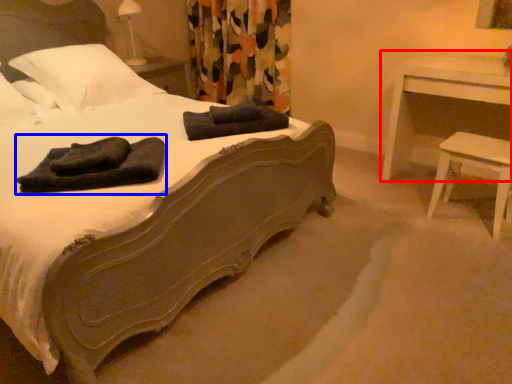
Question: Which object appears farthest to the camera in this image, nightstand (highlighted by a red box) or bath towel (highlighted by a blue box)?

Choices:
 (A) nightstand
 (B) bath towel

Answer: (A)